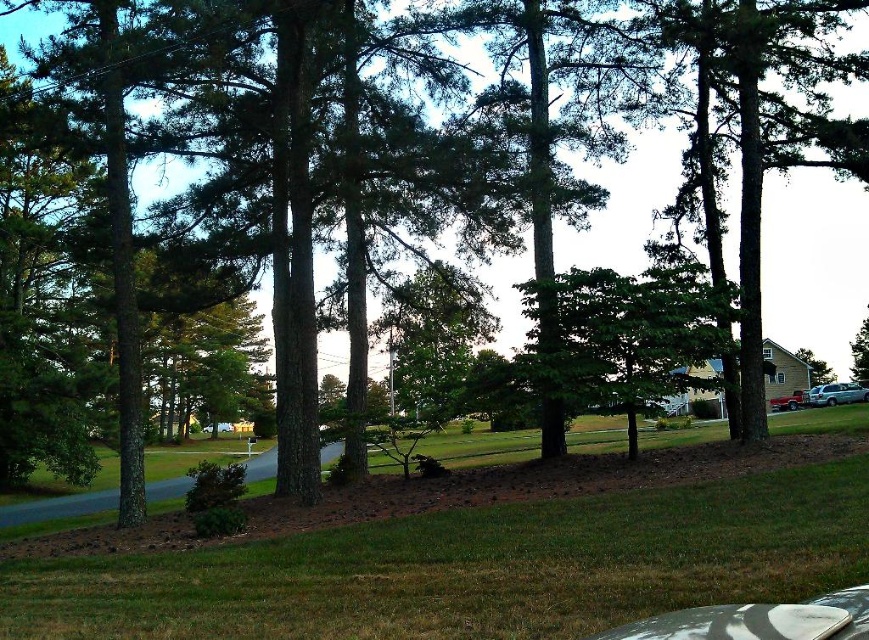
You are standing in the suburban lawn and want to know which tree is taller between the green matte tree at center and the green leafy tree at center. Can you determine this based on their positions?

The green matte tree at center is taller than the green leafy tree at center, so the green matte tree at center is the taller one.

You are standing in the middle of the suburban lawn and see the green matte tree at center and the green leafy tree at right. Which tree is closer to your left side?

The green matte tree at center is positioned on the left side of the green leafy tree at right, so it is closer to your left side.